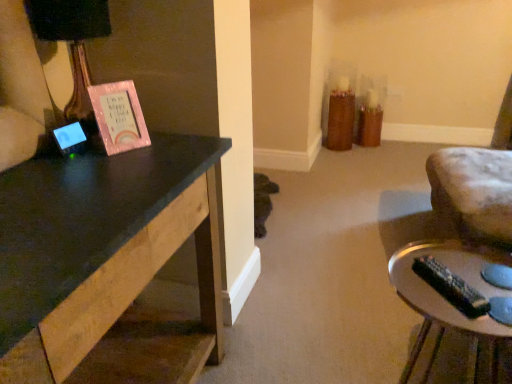
The width and height of the screenshot is (512, 384). Identify the location of vacant region above silver metallic remote control at lower right (from a real-world perspective). (460, 292).